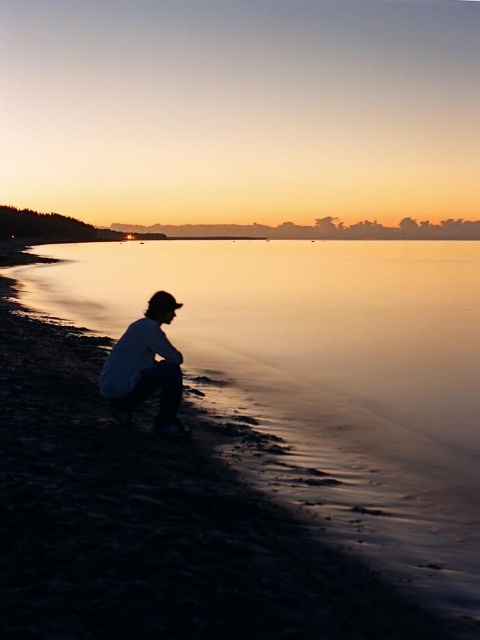
Question: Can you confirm if silky smooth water at center is positioned to the right of matte white shirt at lower center?

Choices:
 (A) no
 (B) yes

Answer: (B)

Question: Does silky smooth water at center have a greater width compared to matte white shirt at lower center?

Choices:
 (A) yes
 (B) no

Answer: (A)

Question: Which of the following is the closest to the observer?

Choices:
 (A) matte white shirt at lower center
 (B) silky smooth water at center

Answer: (A)

Question: Does silky smooth water at center have a greater width compared to matte white shirt at lower center?

Choices:
 (A) yes
 (B) no

Answer: (A)

Question: Among these points, which one is farthest from the camera?

Choices:
 (A) (178, 376)
 (B) (305, 324)

Answer: (B)